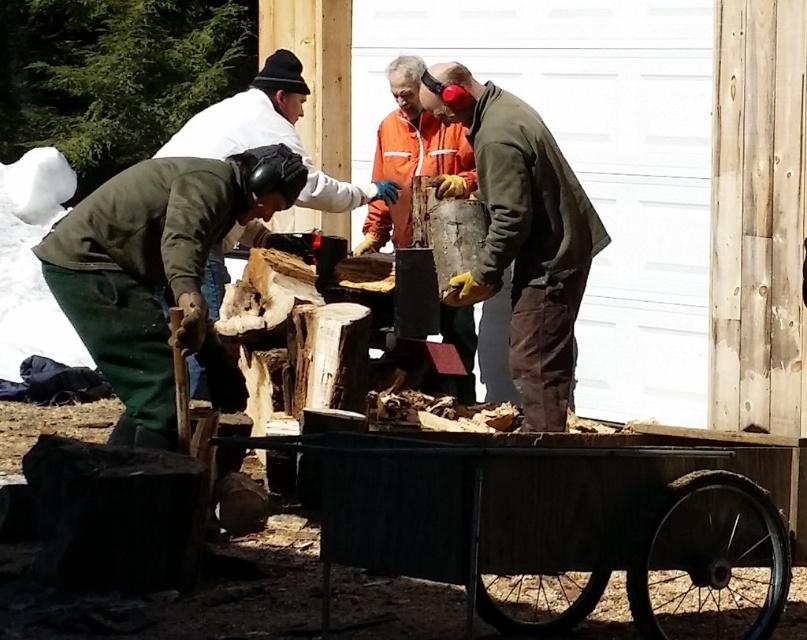
Is rusty metal wagon at lower center positioned in front of rusty metal bucket at center?

Yes, rusty metal wagon at lower center is closer to the viewer.

Can you confirm if rusty metal wagon at lower center is positioned below rusty metal bucket at center?

Indeed, rusty metal wagon at lower center is positioned under rusty metal bucket at center.

Is point (772, 582) farther from camera compared to point (494, 102)?

No, (772, 582) is in front of (494, 102).

The width and height of the screenshot is (807, 640). Find the location of `rusty metal wagon at lower center`. rusty metal wagon at lower center is located at coordinates (555, 520).